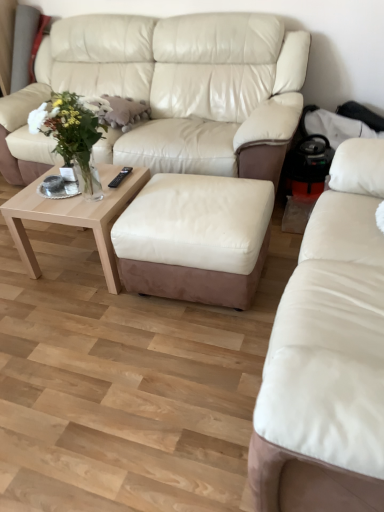
The width and height of the screenshot is (384, 512). I want to click on free space above light wood/texture coffee table at lower center (from a real-world perspective), so click(94, 182).